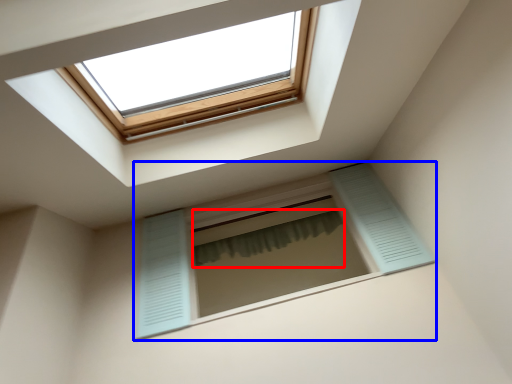
Question: Which object is closer to the camera taking this photo, shower curtain (highlighted by a red box) or window (highlighted by a blue box)?

Choices:
 (A) shower curtain
 (B) window

Answer: (B)